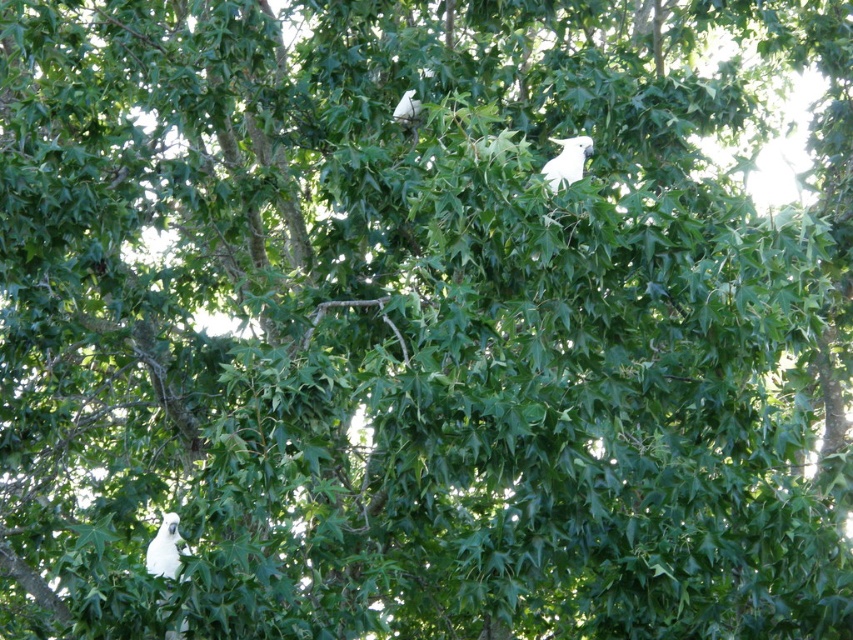
Question: Can you confirm if white feathered bird at lower left is positioned to the right of white feathered bird at upper center?

Choices:
 (A) no
 (B) yes

Answer: (A)

Question: Can you confirm if white feathered bird at lower left is thinner than white feathered bird at upper center?

Choices:
 (A) yes
 (B) no

Answer: (B)

Question: Which point is farther to the camera?

Choices:
 (A) white feathered bird at upper right
 (B) white feathered bird at upper center

Answer: (B)

Question: Which of the following is the closest to the observer?

Choices:
 (A) white feathered bird at upper center
 (B) white feathered bird at upper right

Answer: (B)

Question: Can you confirm if white feathered bird at upper right is positioned to the left of white feathered bird at upper center?

Choices:
 (A) yes
 (B) no

Answer: (B)

Question: Which of these objects is positioned farthest from the white feathered bird at lower left?

Choices:
 (A) white feathered bird at upper center
 (B) white feathered bird at upper right

Answer: (A)